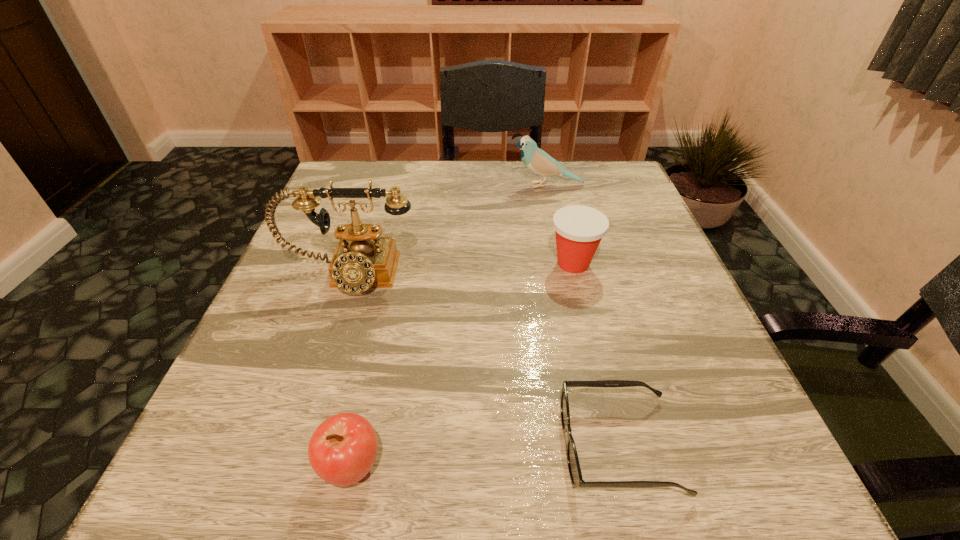
The height and width of the screenshot is (540, 960). I want to click on telephone, so click(362, 259).

Where is `bird`? The height and width of the screenshot is (540, 960). bird is located at coordinates (537, 160).

You are a GUI agent. You are given a task and a screenshot of the screen. Output one action in this format:
    pyautogui.click(x=<x>, y=<y>)
    Task: Click on the farthest object
    Image resolution: width=960 pixels, height=540 pixels.
    Given the screenshot: What is the action you would take?
    pyautogui.click(x=537, y=160)

You are a GUI agent. You are given a task and a screenshot of the screen. Output one action in this format:
    pyautogui.click(x=<x>, y=<y>)
    Task: Click on the Dixie cup
    This screenshot has width=960, height=540.
    Given the screenshot: What is the action you would take?
    tap(579, 229)

Where is `apple`? This screenshot has height=540, width=960. apple is located at coordinates (342, 450).

I want to click on sunglasses, so click(x=577, y=481).

At what (x,y) coordinates should I click in order to perform the action: click on vacant region located on the dial number of the telephone. Please return your answer as a coordinate pair (x, y). The image size is (960, 540). Looking at the image, I should click on (315, 375).

The height and width of the screenshot is (540, 960). What are the coordinates of `free space located 0.250m at the face of the fourth shortest object` in the screenshot? It's located at (413, 185).

I want to click on free point located 0.280m at the face of the fourth shortest object, so click(x=401, y=185).

Identify the location of free space located 0.380m at the face of the fourth shortest object. (362, 185).